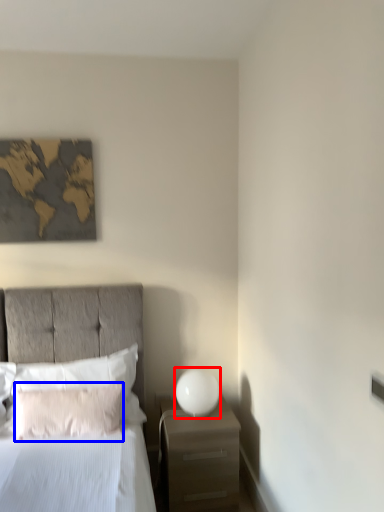
Question: Which point is closer to the camera, bedside lamp (highlighted by a red box) or pillow (highlighted by a blue box)?

Choices:
 (A) bedside lamp
 (B) pillow

Answer: (B)